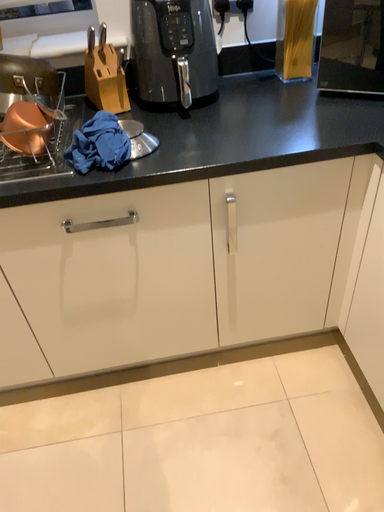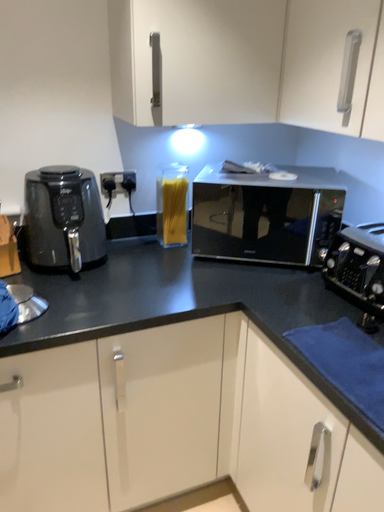
Question: How did the camera likely rotate when shooting the video?

Choices:
 (A) rotated downward
 (B) rotated upward

Answer: (B)